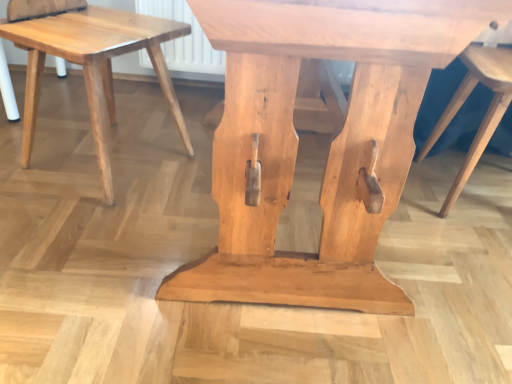
What do you see at coordinates (93, 65) in the screenshot?
I see `natural wood stool at lower left, arranged as the first stool when viewed from the left` at bounding box center [93, 65].

The width and height of the screenshot is (512, 384). Find the location of `natural wood stool at lower left, the 2th stool positioned from the right`. natural wood stool at lower left, the 2th stool positioned from the right is located at coordinates (93, 65).

Measure the distance between natural wood stool at center, acting as the 2th stool starting from the left, and camera.

natural wood stool at center, acting as the 2th stool starting from the left, and camera are 3.56 feet apart.

What do you see at coordinates (486, 113) in the screenshot? I see `natural wood stool at center, the 1th stool in the right-to-left sequence` at bounding box center [486, 113].

You are a GUI agent. You are given a task and a screenshot of the screen. Output one action in this format:
    pyautogui.click(x=<x>, y=<y>)
    Task: Click on the natural wood stool at center, acting as the 2th stool starting from the left
    This screenshot has width=512, height=384.
    Given the screenshot: What is the action you would take?
    pyautogui.click(x=486, y=113)

This screenshot has width=512, height=384. I want to click on natural wood stool at lower left, arranged as the first stool when viewed from the left, so click(93, 65).

Can you confirm if natural wood stool at center, acting as the 2th stool starting from the left, is positioned to the right of natural wood stool at lower left, the 2th stool positioned from the right?

Yes.

In the image, is natural wood stool at center, acting as the 2th stool starting from the left, positioned in front of or behind natural wood stool at lower left, arranged as the first stool when viewed from the left?

Visually, natural wood stool at center, acting as the 2th stool starting from the left, is located behind natural wood stool at lower left, arranged as the first stool when viewed from the left.

Is point (487, 68) in front of point (83, 40)?

No, it is not.

From the image's perspective, is natural wood stool at center, the 1th stool in the right-to-left sequence, located above or below natural wood stool at lower left, arranged as the first stool when viewed from the left?

natural wood stool at center, the 1th stool in the right-to-left sequence, is situated lower than natural wood stool at lower left, arranged as the first stool when viewed from the left, in the image.

From a real-world perspective, is natural wood stool at center, the 1th stool in the right-to-left sequence, under natural wood stool at lower left, arranged as the first stool when viewed from the left?

No.

Which of these two, natural wood stool at center, the 1th stool in the right-to-left sequence, or natural wood stool at lower left, arranged as the first stool when viewed from the left, is wider?

natural wood stool at lower left, arranged as the first stool when viewed from the left, is wider.

Considering the sizes of objects natural wood stool at center, the 1th stool in the right-to-left sequence, and natural wood stool at lower left, the 2th stool positioned from the right, in the image provided, who is shorter, natural wood stool at center, the 1th stool in the right-to-left sequence, or natural wood stool at lower left, the 2th stool positioned from the right,?

natural wood stool at lower left, the 2th stool positioned from the right.

Considering the relative sizes of natural wood stool at center, acting as the 2th stool starting from the left, and natural wood stool at lower left, arranged as the first stool when viewed from the left, in the image provided, is natural wood stool at center, acting as the 2th stool starting from the left, bigger than natural wood stool at lower left, arranged as the first stool when viewed from the left,?

Yes.

Is natural wood stool at center, the 1th stool in the right-to-left sequence, completely or partially outside of natural wood stool at lower left, the 2th stool positioned from the right?

Yes, natural wood stool at center, the 1th stool in the right-to-left sequence, is not within natural wood stool at lower left, the 2th stool positioned from the right.

Would you consider natural wood stool at center, the 1th stool in the right-to-left sequence, to be distant from natural wood stool at lower left, the 2th stool positioned from the right?

No, natural wood stool at center, the 1th stool in the right-to-left sequence, is not far from natural wood stool at lower left, the 2th stool positioned from the right.

Could you tell me if natural wood stool at center, the 1th stool in the right-to-left sequence, is turned towards natural wood stool at lower left, the 2th stool positioned from the right?

No, natural wood stool at center, the 1th stool in the right-to-left sequence, is not turned towards natural wood stool at lower left, the 2th stool positioned from the right.

Can you tell me how much natural wood stool at center, acting as the 2th stool starting from the left, and natural wood stool at lower left, arranged as the first stool when viewed from the left, differ in facing direction?

The angle between the facing direction of natural wood stool at center, acting as the 2th stool starting from the left, and the facing direction of natural wood stool at lower left, arranged as the first stool when viewed from the left, is 59.5 degrees.

The height and width of the screenshot is (384, 512). Identify the location of stool located in front of the natural wood stool at center, the 1th stool in the right-to-left sequence. (93, 65).

Does natural wood stool at lower left, arranged as the first stool when viewed from the left, appear on the left side of natural wood stool at center, acting as the 2th stool starting from the left?

Indeed, natural wood stool at lower left, arranged as the first stool when viewed from the left, is positioned on the left side of natural wood stool at center, acting as the 2th stool starting from the left.

Is natural wood stool at lower left, the 2th stool positioned from the right, behind natural wood stool at center, the 1th stool in the right-to-left sequence?

That is False.

Is point (108, 80) closer to viewer compared to point (464, 183)?

No, (108, 80) is further to viewer.

From the image's perspective, is natural wood stool at lower left, the 2th stool positioned from the right, above or below natural wood stool at center, the 1th stool in the right-to-left sequence?

From the image's perspective, natural wood stool at lower left, the 2th stool positioned from the right, appears above natural wood stool at center, the 1th stool in the right-to-left sequence.

From a real-world perspective, is natural wood stool at lower left, the 2th stool positioned from the right, physically located above or below natural wood stool at center, the 1th stool in the right-to-left sequence?

Clearly, from a real-world perspective, natural wood stool at lower left, the 2th stool positioned from the right, is below natural wood stool at center, the 1th stool in the right-to-left sequence.

Looking at their sizes, would you say natural wood stool at lower left, arranged as the first stool when viewed from the left, is wider or thinner than natural wood stool at center, acting as the 2th stool starting from the left?

In the image, natural wood stool at lower left, arranged as the first stool when viewed from the left, appears to be wider than natural wood stool at center, acting as the 2th stool starting from the left.

From their relative heights in the image, would you say natural wood stool at lower left, arranged as the first stool when viewed from the left, is taller or shorter than natural wood stool at center, the 1th stool in the right-to-left sequence?

In the image, natural wood stool at lower left, arranged as the first stool when viewed from the left, appears to be shorter than natural wood stool at center, the 1th stool in the right-to-left sequence.

Does natural wood stool at lower left, arranged as the first stool when viewed from the left, have a smaller size compared to natural wood stool at center, the 1th stool in the right-to-left sequence?

Indeed, natural wood stool at lower left, arranged as the first stool when viewed from the left, has a smaller size compared to natural wood stool at center, the 1th stool in the right-to-left sequence.

Would you say natural wood stool at lower left, arranged as the first stool when viewed from the left, is inside or outside natural wood stool at center, acting as the 2th stool starting from the left?

The correct answer is: outside.

Is natural wood stool at lower left, arranged as the first stool when viewed from the left, next to natural wood stool at center, the 1th stool in the right-to-left sequence, and touching it?

natural wood stool at lower left, arranged as the first stool when viewed from the left, and natural wood stool at center, the 1th stool in the right-to-left sequence, are not in contact.

Is natural wood stool at lower left, arranged as the first stool when viewed from the left, positioned with its back to natural wood stool at center, the 1th stool in the right-to-left sequence?

That's not correct — natural wood stool at lower left, arranged as the first stool when viewed from the left, is not looking away from natural wood stool at center, the 1th stool in the right-to-left sequence.

At what (x,y) coordinates should I click in order to perform the action: click on stool above the natural wood stool at center, the 1th stool in the right-to-left sequence (from the image's perspective). Please return your answer as a coordinate pair (x, y). Image resolution: width=512 pixels, height=384 pixels. Looking at the image, I should click on (93, 65).

Find the location of `stool on the left side of natural wood stool at center, the 1th stool in the right-to-left sequence`. stool on the left side of natural wood stool at center, the 1th stool in the right-to-left sequence is located at coordinates (93, 65).

At what (x,y) coordinates should I click in order to perform the action: click on stool that is below the natural wood stool at lower left, arranged as the first stool when viewed from the left (from the image's perspective). Please return your answer as a coordinate pair (x, y). The width and height of the screenshot is (512, 384). Looking at the image, I should click on (486, 113).